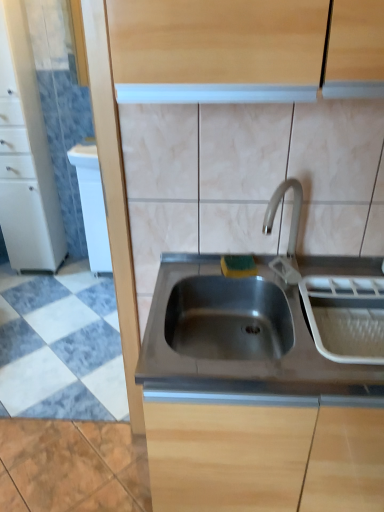
The image size is (384, 512). Find the location of `vacant area situated to the left side of white glossy dishwasher at left`. vacant area situated to the left side of white glossy dishwasher at left is located at coordinates (71, 274).